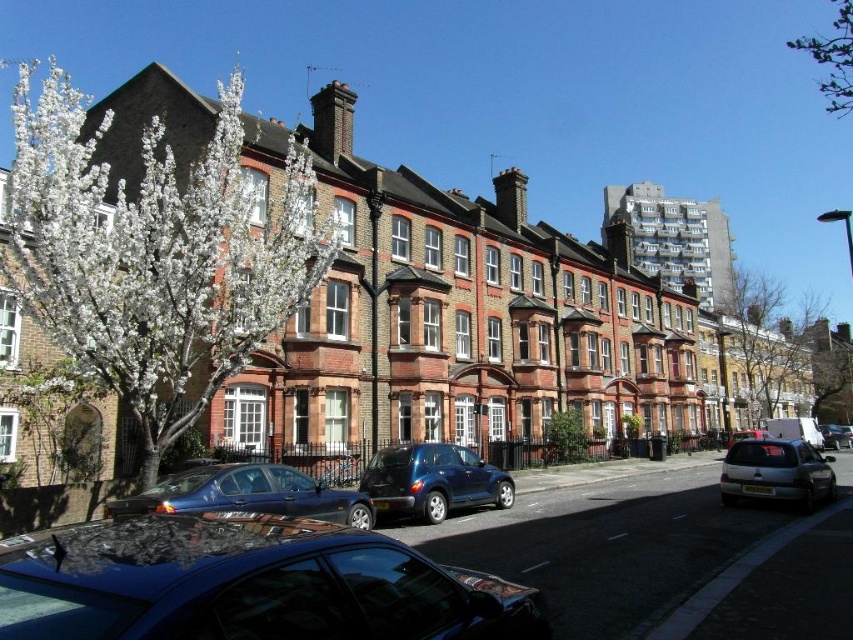
Based on the photo, you are a delivery driver trying to park your vehicle between the glossy metallic sedan at center and the green leafy tree at upper right. Based on their heights, can you determine which one you should avoid hitting the top of your truck?

The glossy metallic sedan at center is not as tall as the green leafy tree at upper right, so you should avoid hitting the top of the green leafy tree at upper right since it is taller.

You are a delivery person who needs to place a small package on the sidewalk between the white blossoms at left and the black rubber car at center. Can you fit the package there without blocking the car?

The white blossoms at left are larger in size than the black rubber car at center, so there is enough space between them to place the small package without blocking the car.

You are a delivery driver who needs to park your vehicle between the glossy black car at lower center and the satin silver hatchback at lower right. Your delivery van is 5 meters long. Can you fit your van in the space between them?

The glossy black car at lower center is smaller than the satin silver hatchback at lower right, but there is no information provided about the distance between them. Therefore, it is impossible to determine if the van can fit in the space between them.